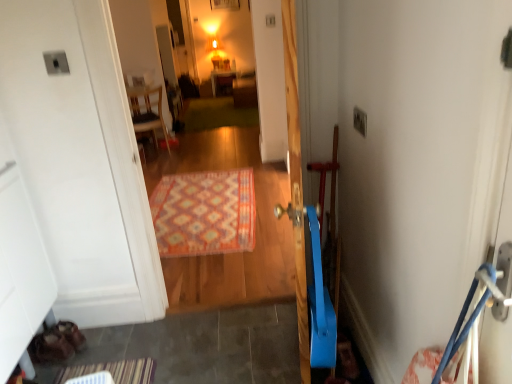
Question: In which direction should I rotate to look at matte wooden cabinet at center, which is the 2th furniture from front to back?

Choices:
 (A) right
 (B) left

Answer: (B)

Question: Would you say matte wooden cabinet at center, placed as the first furniture when sorted from right to left, contains carpeted rug at center?

Choices:
 (A) yes
 (B) no

Answer: (B)

Question: From the image's perspective, would you say matte wooden cabinet at center, acting as the second furniture starting from the bottom, is positioned over carpeted rug at center?

Choices:
 (A) yes
 (B) no

Answer: (A)

Question: Considering the relative sizes of matte wooden cabinet at center, acting as the second furniture starting from the bottom, and carpeted rug at center in the image provided, is matte wooden cabinet at center, acting as the second furniture starting from the bottom, thinner than carpeted rug at center?

Choices:
 (A) no
 (B) yes

Answer: (A)

Question: Can you confirm if matte wooden cabinet at center, which is counted as the 1th furniture, starting from the back, is bigger than carpeted rug at center?

Choices:
 (A) yes
 (B) no

Answer: (B)

Question: Is matte wooden cabinet at center, acting as the second furniture starting from the bottom, facing away from carpeted rug at center?

Choices:
 (A) yes
 (B) no

Answer: (B)

Question: Is matte wooden cabinet at center, which is the 2th furniture from front to back, closer to camera compared to carpeted rug at center?

Choices:
 (A) no
 (B) yes

Answer: (A)

Question: Can wooden chair at upper left, the 2th furniture positioned from the top, be found inside carpeted rug at center?

Choices:
 (A) no
 (B) yes

Answer: (A)

Question: Is carpeted rug at center with wooden chair at upper left, which appears as the 1th furniture when ordered from the bottom?

Choices:
 (A) yes
 (B) no

Answer: (B)

Question: Is carpeted rug at center thinner than wooden chair at upper left, which appears as the 1th furniture when ordered from the bottom?

Choices:
 (A) no
 (B) yes

Answer: (B)

Question: Considering the relative sizes of carpeted rug at center and wooden chair at upper left, which ranks as the 1th furniture in left-to-right order, in the image provided, is carpeted rug at center wider than wooden chair at upper left, which ranks as the 1th furniture in left-to-right order,?

Choices:
 (A) yes
 (B) no

Answer: (B)

Question: Does carpeted rug at center have a greater height compared to wooden chair at upper left, which ranks as the 2th furniture in back-to-front order?

Choices:
 (A) no
 (B) yes

Answer: (B)

Question: From the image's perspective, is carpeted rug at center below wooden chair at upper left, the 2th furniture positioned from the top?

Choices:
 (A) yes
 (B) no

Answer: (A)

Question: Is carpeted rug at center bigger than matte wooden cabinet at center, which is the 2th furniture from front to back?

Choices:
 (A) no
 (B) yes

Answer: (B)